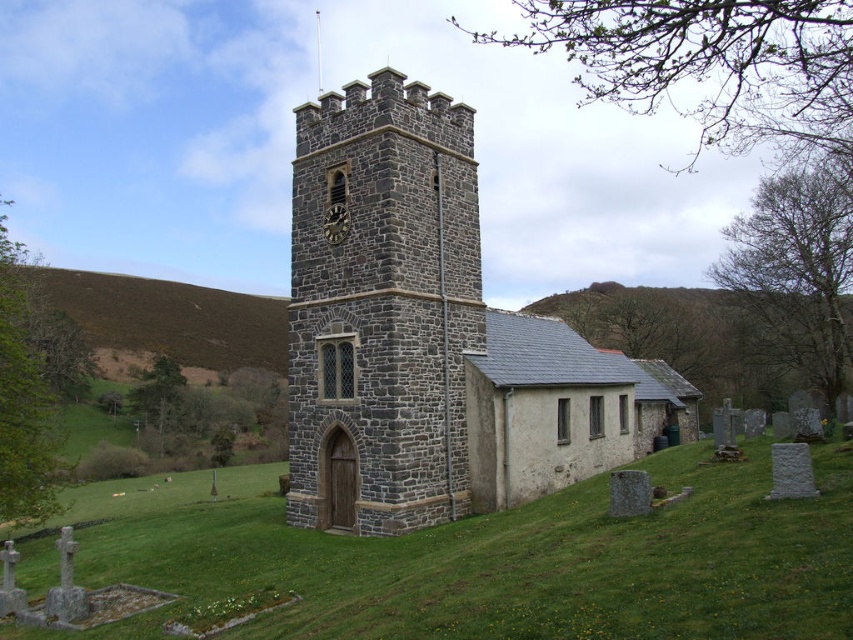
Can you confirm if gray stone church at center is shorter than green grass at lower center?

Incorrect, gray stone church at center's height does not fall short of green grass at lower center's.

Is gray stone church at center further to the viewer compared to green grass at lower center?

Yes, it is.

At what (x,y) coordinates should I click in order to perform the action: click on gray stone church at center. Please return your answer as a coordinate pair (x, y). This screenshot has width=853, height=640. Looking at the image, I should click on (431, 336).

This screenshot has width=853, height=640. I want to click on gray stone church at center, so click(431, 336).

Which is more to the left, green grass at lower center or dark gray stone tower at center?

dark gray stone tower at center

Who is shorter, green grass at lower center or dark gray stone tower at center?

green grass at lower center is shorter.

What do you see at coordinates (525, 563) in the screenshot? The height and width of the screenshot is (640, 853). I see `green grass at lower center` at bounding box center [525, 563].

This screenshot has height=640, width=853. I want to click on green grass at lower center, so click(x=525, y=563).

Can you confirm if gray stone church at center is wider than dark gray stone tower at center?

Indeed, gray stone church at center has a greater width compared to dark gray stone tower at center.

Between gray stone church at center and dark gray stone tower at center, which one is positioned lower?

gray stone church at center is below.

Locate an element on the screen. gray stone church at center is located at coordinates (431, 336).